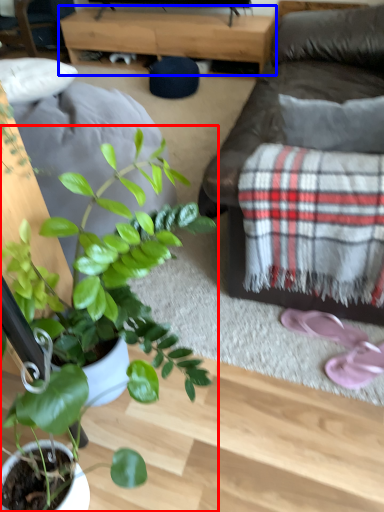
Question: Among these objects, which one is nearest to the camera, houseplant (highlighted by a red box) or table (highlighted by a blue box)?

Choices:
 (A) houseplant
 (B) table

Answer: (A)